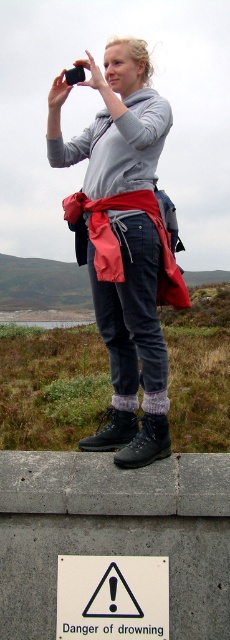
You are a safety inspector checking the scene. You notice the gray concrete at upper center and the matte gray hoodie at center. According to safety regulations, the warning sign must be placed where in relation to these two objects?

The warning sign must be placed above the gray concrete at upper center since it is located below the matte gray hoodie at center, ensuring visibility to those approaching the edge.

You are a delivery drone operator. Your drone is currently hovering above the gray concrete at upper center and needs to land on the white plastic sign at lower center. Can the drone safely descend vertically to the sign without hitting any obstacles?

The distance between the gray concrete at upper center and the white plastic sign at lower center is 8.44 inches. Since the drone needs to descend vertically, it can safely land on the white plastic sign at lower center as there are no obstacles mentioned between them in the scene description.

You are a photographer trying to capture a clear shot of both the matte gray hoodie at center and the white plastic sign at lower center in the image. Given their distance apart, can you fit both into your camera frame without moving your position?

The matte gray hoodie at center and the white plastic sign at lower center are 30.50 inches apart from each other. Since the distance between them is fixed, you can adjust your camera angle or zoom to ensure both fit within the frame without needing to move your position.